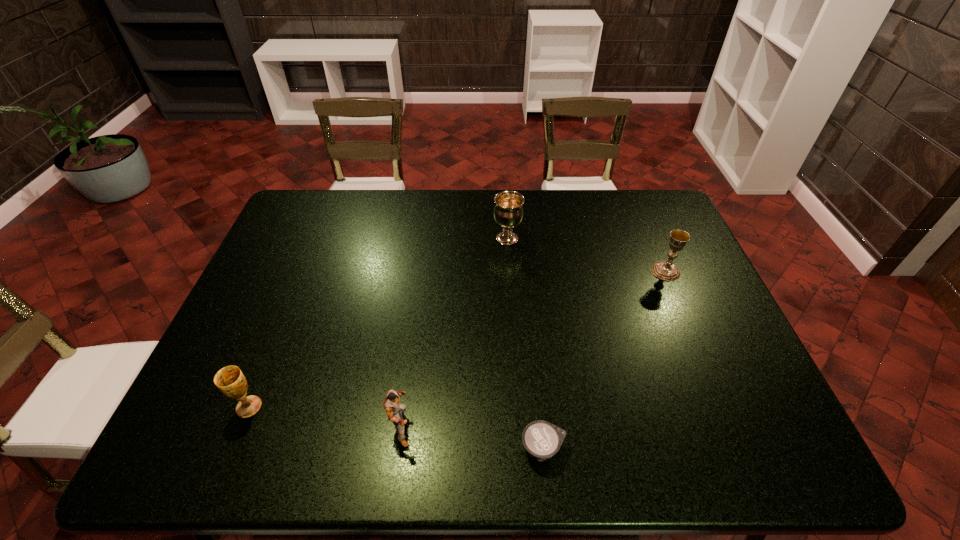
The image size is (960, 540). In order to click on the second chalice from left to right in this screenshot , I will do `click(508, 212)`.

Where is `the farthest object`? The image size is (960, 540). the farthest object is located at coordinates (508, 212).

This screenshot has height=540, width=960. Find the location of `the rightmost chalice`. the rightmost chalice is located at coordinates (665, 270).

This screenshot has width=960, height=540. What are the coordinates of `the rightmost object` in the screenshot? It's located at (665, 270).

The width and height of the screenshot is (960, 540). Find the location of `the leftmost object`. the leftmost object is located at coordinates (230, 380).

The width and height of the screenshot is (960, 540). In order to click on the leftmost chalice in this screenshot , I will do point(230,380).

Locate an element on the screen. The height and width of the screenshot is (540, 960). the second object from left to right is located at coordinates click(394, 410).

Locate an element on the screen. The image size is (960, 540). the shortest object is located at coordinates (541, 439).

Locate an element on the screen. The image size is (960, 540). vacant space positioned 0.150m on the front of the farthest chalice is located at coordinates [x=510, y=281].

At what (x,y) coordinates should I click in order to perform the action: click on free space located on the front of the rightmost chalice. Please return your answer as a coordinate pair (x, y). The height and width of the screenshot is (540, 960). Looking at the image, I should click on (699, 350).